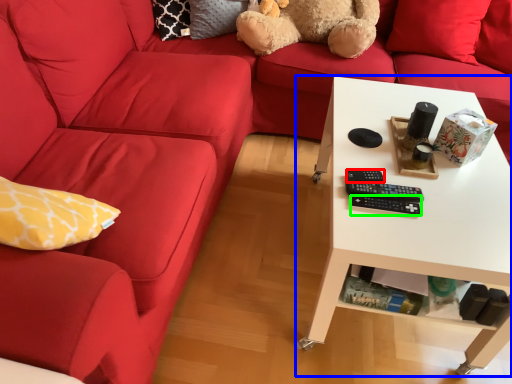
Question: Which is nearer to the control (highlighted by a red box)? table (highlighted by a blue box) or control (highlighted by a green box).

Choices:
 (A) table
 (B) control

Answer: (B)